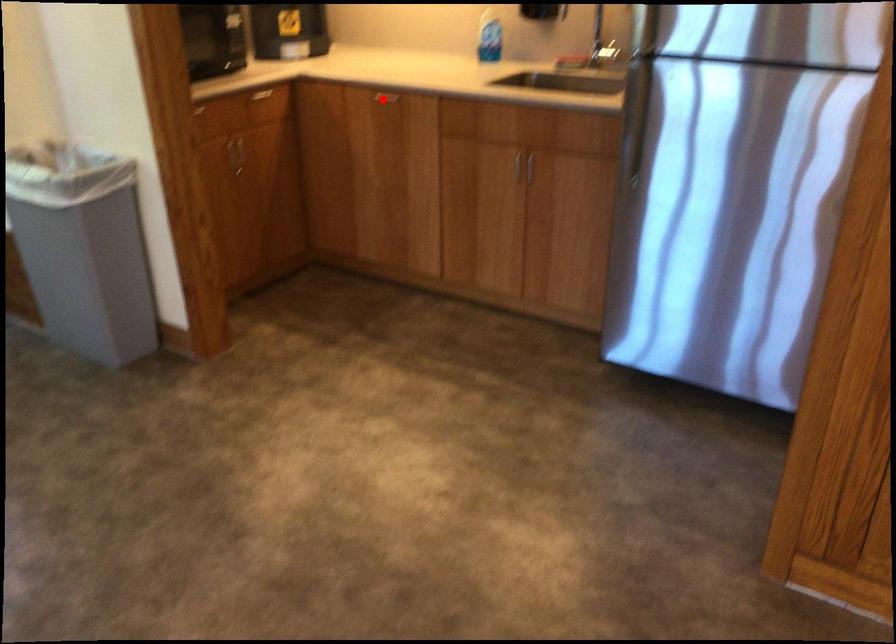
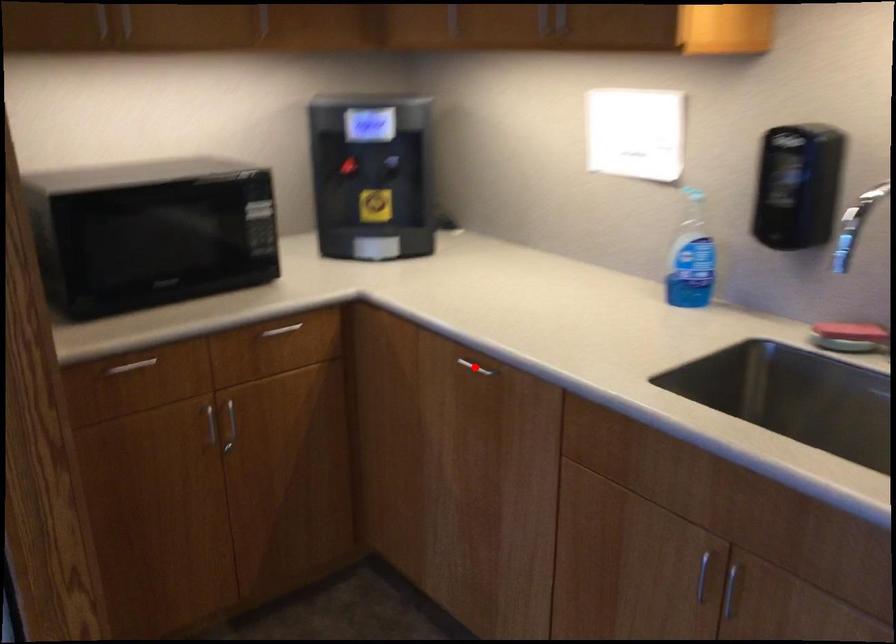
I am providing you with two images of the same scene from different viewpoints. A red point is marked on the first image and another point is marked on the second image. Are the points marked in image1 and image2 representing the same 3D position?

Yes